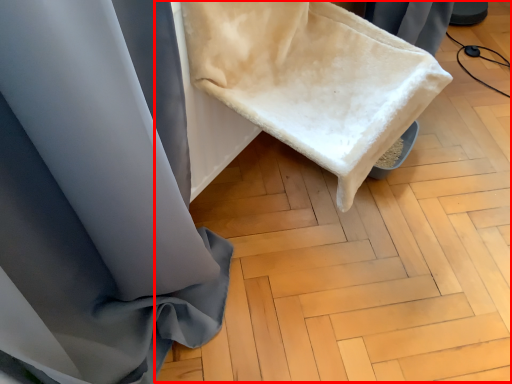
Question: From the image's perspective, what is the correct spatial positioning of wood (annotated by the red box) in reference to wide?

Choices:
 (A) below
 (B) above

Answer: (A)